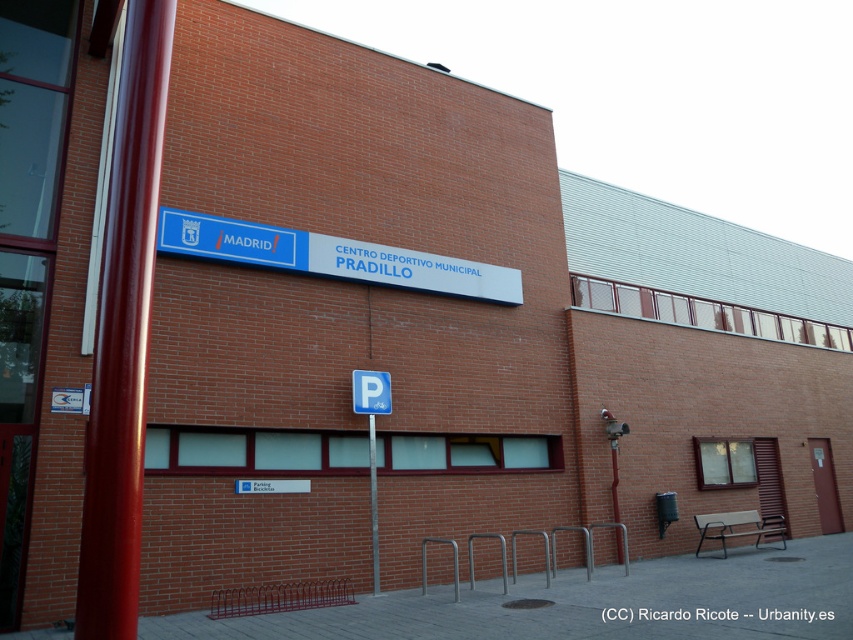
You are standing in front of the Centro Deportivo Municipal Pradillo and want to park your bike. You see a blue plastic parking sign at lower center and a metallic pole at center. Which object is wider?

The blue plastic parking sign at lower center is wider than the metallic pole at center.

You are standing in front of the Centro Deportivo Municipal Pradillo and want to locate the blue plastic sign at center. According to the coordinates provided, where exactly is it positioned?

The blue plastic sign at center is located at coordinates point (x=332, y=257).